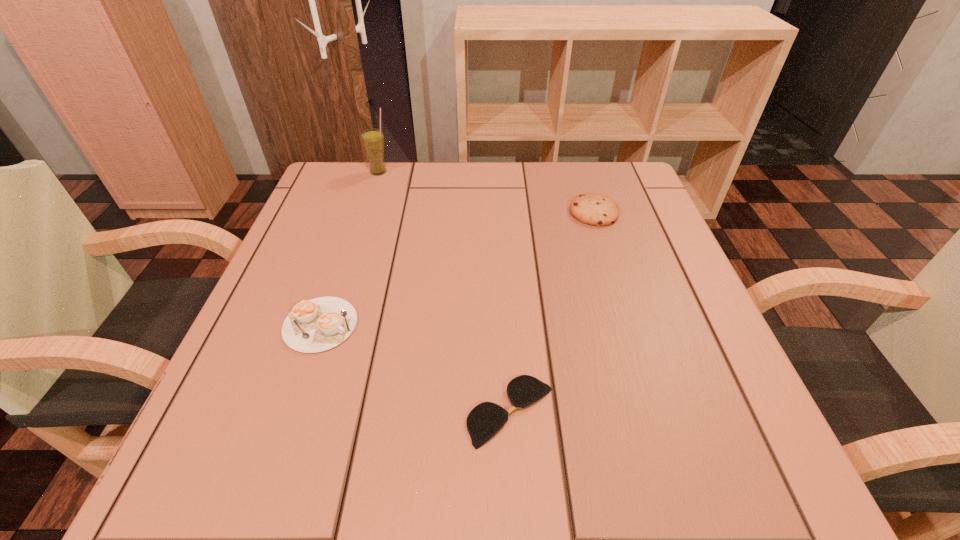
Image resolution: width=960 pixels, height=540 pixels. In order to click on straw for drinking in this screenshot , I will do `click(372, 139)`.

Locate an element on the screen. the tallest object is located at coordinates (372, 139).

Locate an element on the screen. cookie is located at coordinates (593, 209).

At what (x,y) coordinates should I click in order to perform the action: click on the second farthest object. Please return your answer as a coordinate pair (x, y). The width and height of the screenshot is (960, 540). Looking at the image, I should click on (593, 209).

At what (x,y) coordinates should I click in order to perform the action: click on cappuccino. Please return your answer as a coordinate pair (x, y). Image resolution: width=960 pixels, height=540 pixels. Looking at the image, I should click on (316, 325).

I want to click on the second nearest object, so click(x=316, y=325).

At what (x,y) coordinates should I click in order to perform the action: click on the shortest object. Please return your answer as a coordinate pair (x, y). Looking at the image, I should click on (486, 419).

This screenshot has width=960, height=540. Identify the location of the nearest object. (486, 419).

You are a GUI agent. You are given a task and a screenshot of the screen. Output one action in this format:
    pyautogui.click(x=<x>, y=<y>)
    Task: Click on the vacant space located on the right of the farthest object
    This screenshot has height=540, width=960.
    Given the screenshot: What is the action you would take?
    pyautogui.click(x=505, y=172)

Find the location of a particular element. This screenshot has height=540, width=960. vacant region located 0.050m on the right of the cookie is located at coordinates (640, 212).